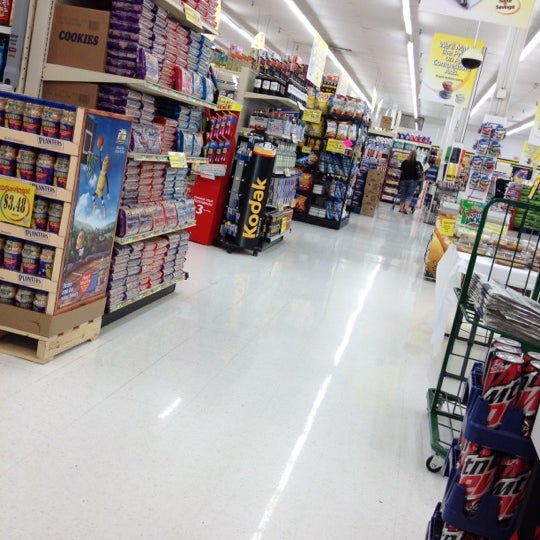
The width and height of the screenshot is (540, 540). Find the location of `product shelves`. product shelves is located at coordinates (148, 171), (271, 84), (327, 110), (346, 124), (326, 165), (313, 193), (308, 209), (384, 141), (380, 158).